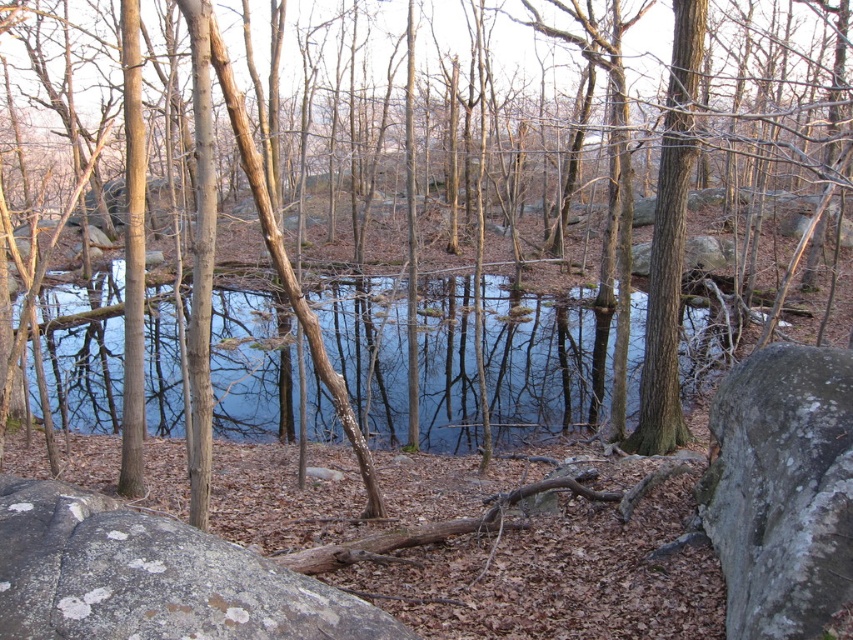
You are a hiker who wants to cross the gray rough rock at lower right to reach the clear water at center. Is the rock a stable surface for walking?

The clear water at center is positioned over gray rough rock at lower right, meaning the rock is submerged under the water. This makes the surface slippery and unstable for walking.